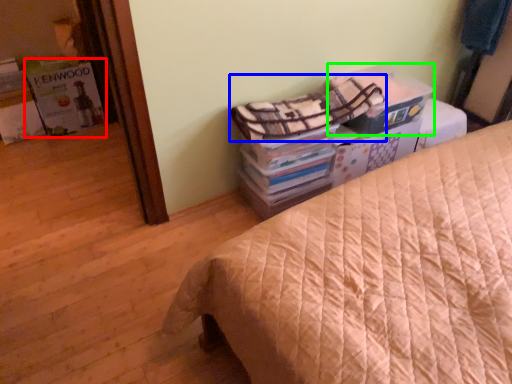
Question: Based on their relative distances, which object is farther from magazine (highlighted by a red box)? Choose from blanket (highlighted by a blue box) and cardboard box (highlighted by a green box).

Choices:
 (A) blanket
 (B) cardboard box

Answer: (B)